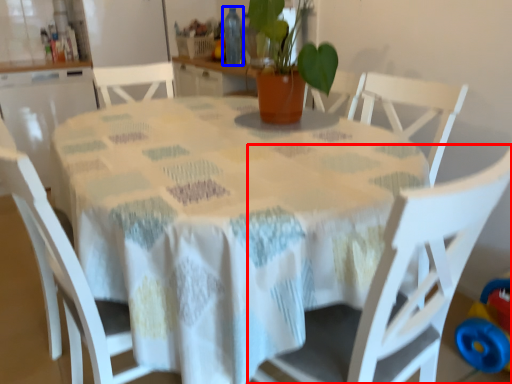
Question: Which object appears farthest to the camera in this image, chair (highlighted by a red box) or bottle (highlighted by a blue box)?

Choices:
 (A) chair
 (B) bottle

Answer: (B)